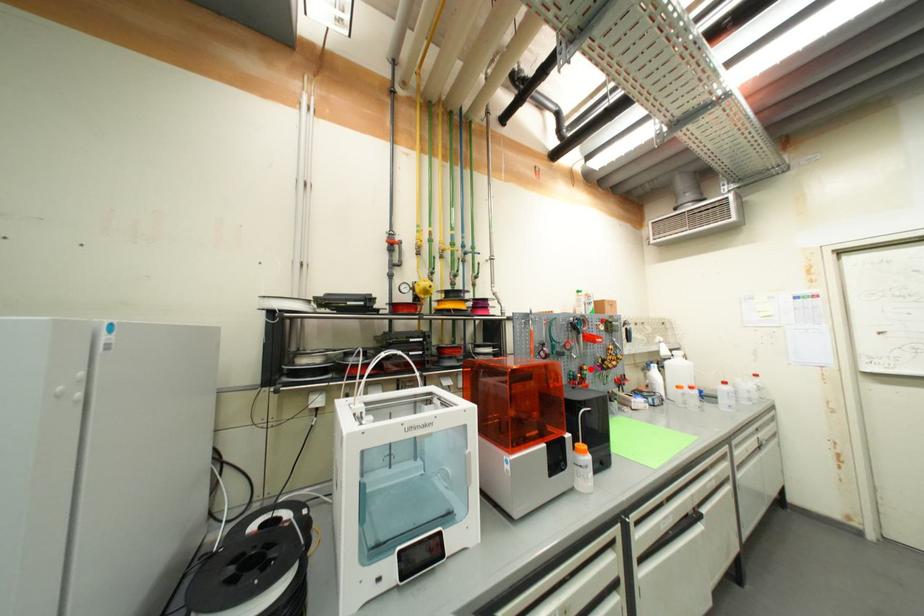
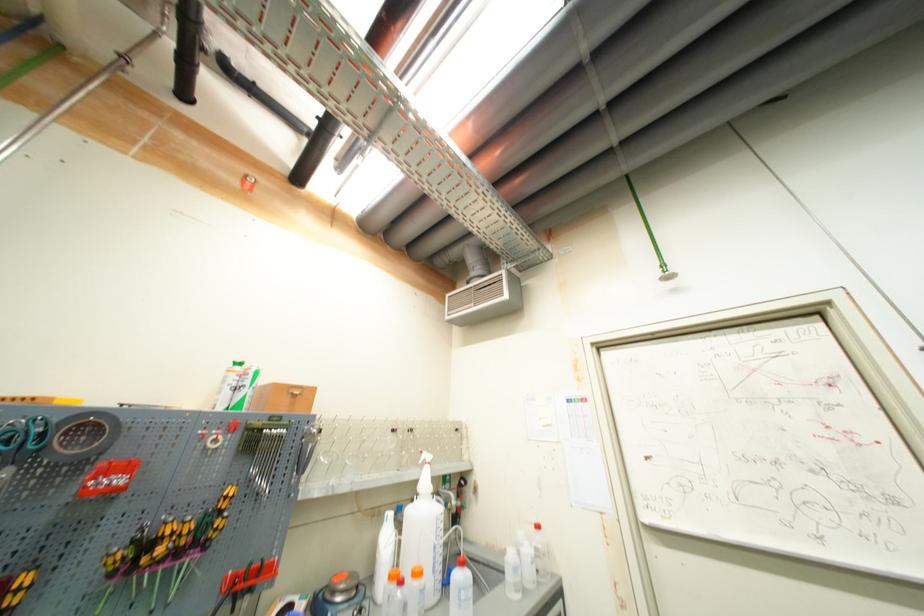
Question: I am providing you with two images of the same scene from different viewpoints. Given a red point in image1, look at the same physical point in image2. Is it:

Choices:
 (A) Closer to the viewpoint
 (B) Farther from the viewpoint

Answer: (A)